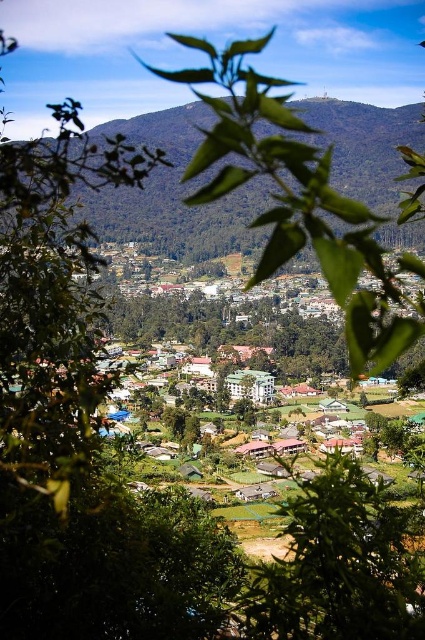
You are standing in the scenic valley town and want to take a photo of the green leafy mountain at center. According to the image coordinates, where exactly should you position your camera to capture the mountain?

The green leafy mountain at center is located at point [173,193], so you should position your camera at those coordinates to capture it.

You are an architect designing a new park in the town. You want to place a statue in the park such that it is visible from both the green leafy mountain at center and the green leafy tree at center. Which object should the statue be closer to to ensure visibility from both?

The statue should be closer to the green leafy tree at center because it is smaller than the green leafy mountain at center, so positioning it nearer to the tree ensures it can be seen from both the mountain and the tree.

You are standing in the scenic valley and want to take a photo of the town. You notice the green leafy mountain at center and the green leafy tree at center. Which object should you position to the right side of your camera frame to ensure the town is fully visible?

You should position the green leafy tree at center to the right side of your camera frame because the green leafy mountain at center is to the left of the green leafy tree at center, so placing the tree on the right will keep the mountain on the left and allow the town in the valley to be fully visible.